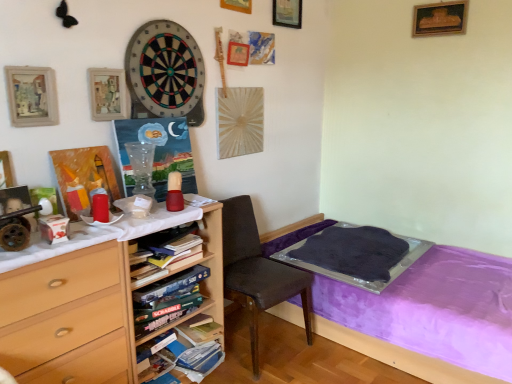
Question: Is brown fabric chair at center at the right side of wooden desk at left?

Choices:
 (A) no
 (B) yes

Answer: (B)

Question: Can you confirm if brown fabric chair at center is positioned to the left of wooden desk at left?

Choices:
 (A) yes
 (B) no

Answer: (B)

Question: Does brown fabric chair at center have a greater width compared to wooden desk at left?

Choices:
 (A) yes
 (B) no

Answer: (A)

Question: Is brown fabric chair at center facing away from wooden desk at left?

Choices:
 (A) yes
 (B) no

Answer: (B)

Question: From the image's perspective, is brown fabric chair at center beneath wooden desk at left?

Choices:
 (A) yes
 (B) no

Answer: (B)

Question: From a real-world perspective, is brown fabric chair at center on top of wooden desk at left?

Choices:
 (A) yes
 (B) no

Answer: (B)

Question: Is soft felt dartboard at upper center positioned far away from brown fabric chair at center?

Choices:
 (A) yes
 (B) no

Answer: (B)

Question: Does soft felt dartboard at upper center have a lesser width compared to brown fabric chair at center?

Choices:
 (A) no
 (B) yes

Answer: (B)

Question: Is soft felt dartboard at upper center located outside brown fabric chair at center?

Choices:
 (A) no
 (B) yes

Answer: (B)

Question: From a real-world perspective, is soft felt dartboard at upper center positioned over brown fabric chair at center based on gravity?

Choices:
 (A) no
 (B) yes

Answer: (B)

Question: Considering the relative positions of soft felt dartboard at upper center and brown fabric chair at center in the image provided, is soft felt dartboard at upper center to the right of brown fabric chair at center from the viewer's perspective?

Choices:
 (A) yes
 (B) no

Answer: (B)

Question: Is soft felt dartboard at upper center positioned with its back to brown fabric chair at center?

Choices:
 (A) yes
 (B) no

Answer: (B)

Question: Is there a large distance between matte white box at left and purple fabric bed at lower right?

Choices:
 (A) no
 (B) yes

Answer: (B)